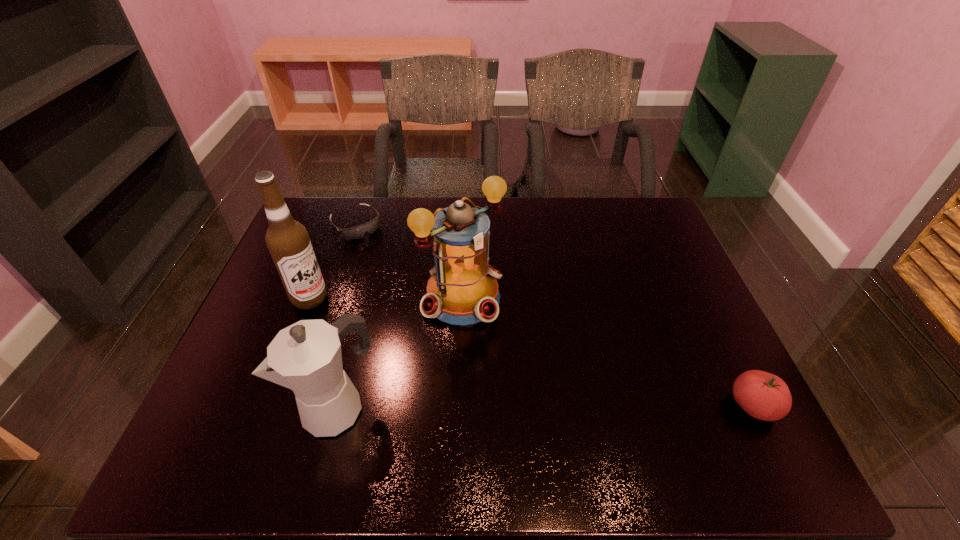
Locate an element on the screen. This screenshot has height=540, width=960. coffeepot that is at the near edge is located at coordinates (306, 357).

You are a GUI agent. You are given a task and a screenshot of the screen. Output one action in this format:
    pyautogui.click(x=<x>, y=<y>)
    Task: Click on the tomato that is at the near edge
    The width and height of the screenshot is (960, 540).
    Given the screenshot: What is the action you would take?
    pyautogui.click(x=764, y=396)

I want to click on alcohol that is at the left edge, so (287, 240).

At what (x,y) coordinates should I click in order to perform the action: click on goggles that is at the left edge. Please return your answer as a coordinate pair (x, y). Looking at the image, I should click on (357, 232).

You are a GUI agent. You are given a task and a screenshot of the screen. Output one action in this format:
    pyautogui.click(x=<x>, y=<y>)
    Task: Click on the object situated at the right edge
    This screenshot has height=540, width=960.
    Given the screenshot: What is the action you would take?
    pyautogui.click(x=764, y=396)

What are the coordinates of `object that is positioned at the far left corner` in the screenshot? It's located at (357, 232).

At what (x,y) coordinates should I click in order to perform the action: click on object that is at the near right corner. Please return your answer as a coordinate pair (x, y). This screenshot has height=540, width=960. Looking at the image, I should click on (764, 396).

Find the location of a particular element. The height and width of the screenshot is (540, 960). vacant point at the far edge is located at coordinates (454, 202).

The image size is (960, 540). I want to click on vacant space at the right edge of the desktop, so click(x=668, y=373).

This screenshot has width=960, height=540. In the image, there is a desktop. What are the coordinates of `vacant space at the far left corner` in the screenshot? It's located at (322, 231).